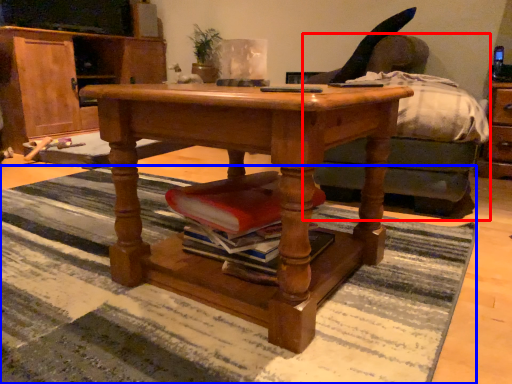
Question: Which of the following is the closest to the observer, studio couch (highlighted by a red box) or mat (highlighted by a blue box)?

Choices:
 (A) studio couch
 (B) mat

Answer: (B)